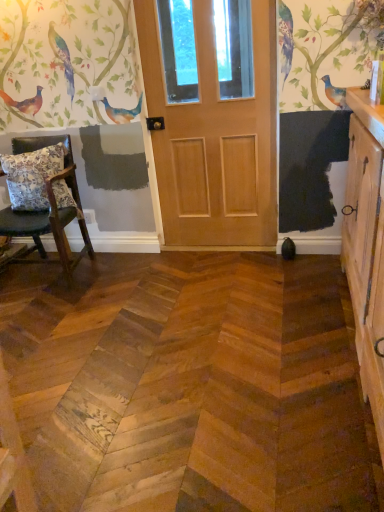
Question: Considering the positions of floral fabric cushion at left and wooden chair with cushion at left in the image, is floral fabric cushion at left taller or shorter than wooden chair with cushion at left?

Choices:
 (A) tall
 (B) short

Answer: (B)

Question: From the image's perspective, is floral fabric cushion at left located above or below wooden chair with cushion at left?

Choices:
 (A) above
 (B) below

Answer: (A)

Question: Considering the real-world distances, which object is farthest from the wooden cabinet at right?

Choices:
 (A) natural wood door at center
 (B) floral fabric cushion at left
 (C) wooden chair with cushion at left

Answer: (B)

Question: Considering the real-world distances, which object is closest to the wooden chair with cushion at left?

Choices:
 (A) natural wood door at center
 (B) floral fabric cushion at left
 (C) wooden cabinet at right

Answer: (B)